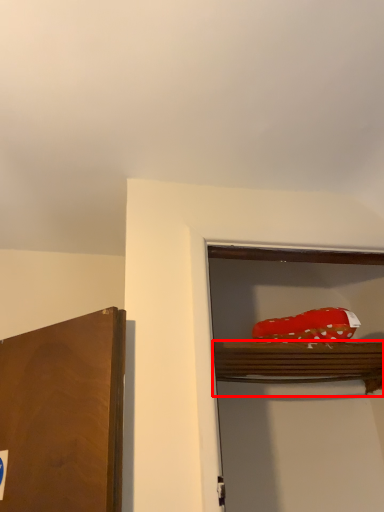
Question: From the image's perspective, considering the relative positions of shelf (annotated by the red box) and food in the image provided, where is shelf (annotated by the red box) located with respect to the staircase?

Choices:
 (A) below
 (B) above

Answer: (A)